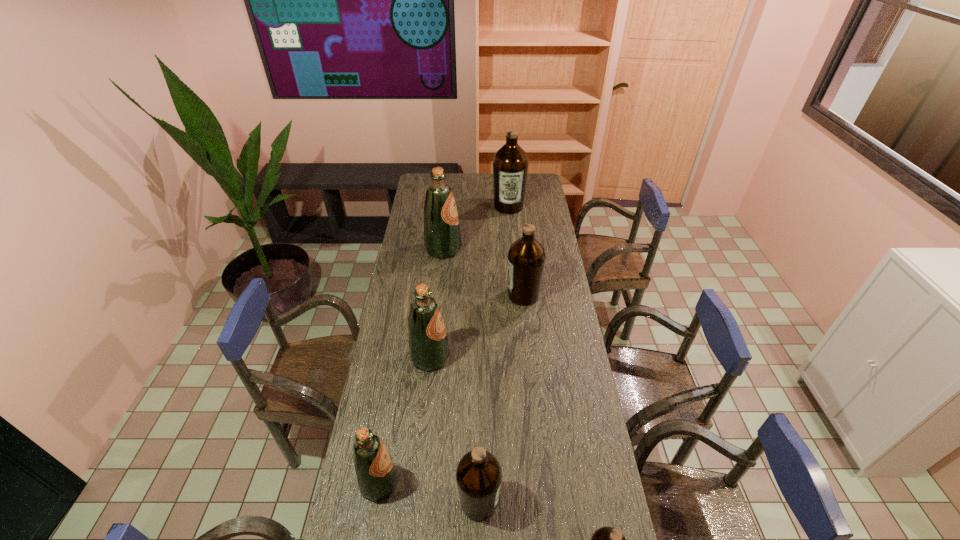
Find the location of a particular element. This screenshot has height=540, width=960. the third biggest brown olive oil is located at coordinates (x=478, y=475).

Identify the location of vacant area located 0.130m on the front-facing side of the sixth nearest olive oil. This screenshot has height=540, width=960. (488, 249).

The width and height of the screenshot is (960, 540). I want to click on vacant point located on the label of the farthest object, so click(x=512, y=243).

In order to click on free space located 0.320m on the front-facing side of the second biggest green olive oil in this screenshot , I will do `click(532, 357)`.

You are a GUI agent. You are given a task and a screenshot of the screen. Output one action in this format:
    pyautogui.click(x=<x>, y=<y>)
    Task: Click on the free space located on the label of the third smallest brown olive oil
    This screenshot has width=960, height=540.
    Given the screenshot: What is the action you would take?
    pyautogui.click(x=426, y=295)

At what (x,y) coordinates should I click in order to perform the action: click on blank space located 0.220m on the label of the third smallest brown olive oil. Please return your answer as a coordinate pair (x, y). The height and width of the screenshot is (540, 960). Looking at the image, I should click on (457, 295).

You are a GUI agent. You are given a task and a screenshot of the screen. Output one action in this format:
    pyautogui.click(x=<x>, y=<y>)
    Task: Click on the vacant region located 0.220m on the label of the third smallest brown olive oil
    This screenshot has height=540, width=960.
    Given the screenshot: What is the action you would take?
    pyautogui.click(x=457, y=295)

This screenshot has width=960, height=540. What are the coordinates of `vacant area situated on the front-facing side of the smallest green olive oil` in the screenshot? It's located at (512, 483).

The width and height of the screenshot is (960, 540). In order to click on free space located 0.060m on the label of the second nearest brown olive oil in this screenshot , I will do `click(520, 502)`.

The image size is (960, 540). I want to click on blank space at the left edge, so click(408, 289).